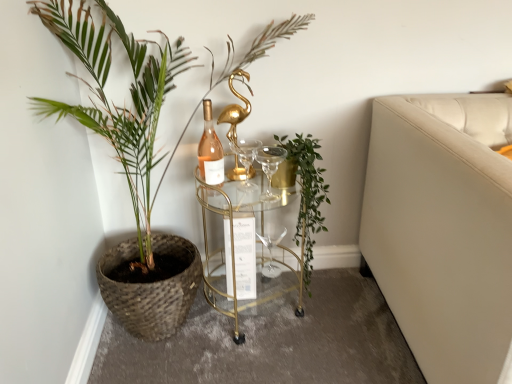
Locate an element on the screen. space that is in front of gold glass table at center is located at coordinates (248, 356).